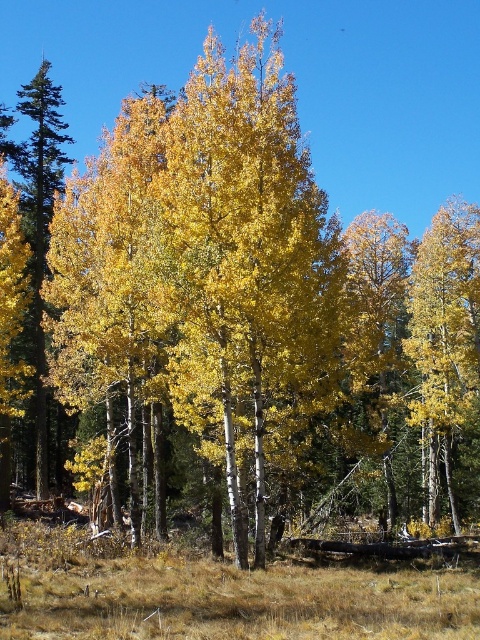
Which of these two, yellow matte tree at center or smooth green pine tree at left, stands shorter?

Standing shorter between the two is yellow matte tree at center.

Locate an element on the screen. yellow matte tree at center is located at coordinates (444, 337).

Does point (457, 248) come behind point (36, 211)?

No, (457, 248) is closer to viewer.

Locate an element on the screen. Image resolution: width=480 pixels, height=640 pixels. yellow matte tree at center is located at coordinates point(444,337).